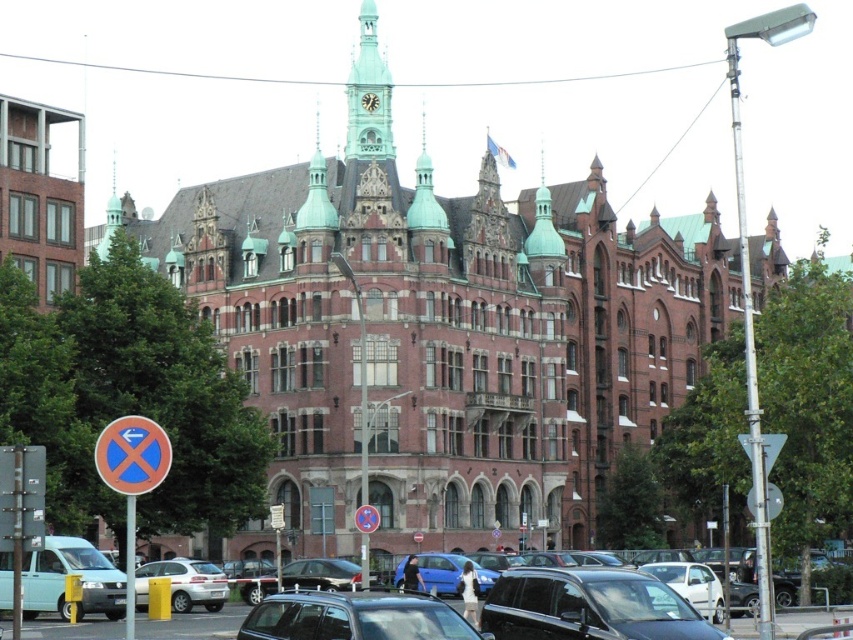
You are a delivery driver who needs to park your truck, which is 2 meters wide, in the parking area near the blue circular sign at left and the silver metallic sedan at lower center. Can your truck fit between them based on their widths?

The blue circular sign at left is narrower than the silver metallic sedan at lower center. However, the width of the blue circular sign at left alone does not provide enough information to determine if there is sufficient space between them for a 2 meter wide truck. More details about the distance between the two objects are needed to make an accurate assessment.

You are a pedestrian standing in front of the ornate building and want to cross the parking area to reach the entrance. You see a metallic silver car at center and a silver metallic sedan at lower center. Which vehicle is closer to you?

The metallic silver car at center is closer to you because it is positioned in front of the silver metallic sedan at lower center.